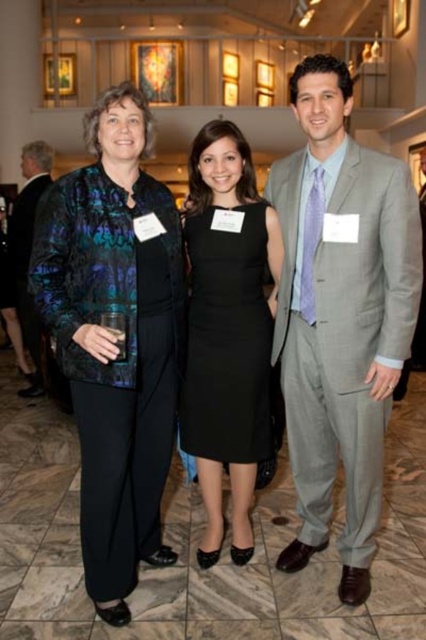
Question: Which point is farther to the camera?

Choices:
 (A) black satin dress at center
 (B) matte black suit at left

Answer: (B)

Question: Is gray suit at center wider than black satin dress at center?

Choices:
 (A) no
 (B) yes

Answer: (B)

Question: Is velvet-like black pantsuit at left below matte black suit at left?

Choices:
 (A) yes
 (B) no

Answer: (A)

Question: Is gray suit at center bigger than velvet-like black pantsuit at left?

Choices:
 (A) no
 (B) yes

Answer: (A)

Question: Estimate the real-world distances between objects in this image. Which object is farther from the black satin dress at center?

Choices:
 (A) gray suit at center
 (B) velvet-like black pantsuit at left
 (C) matte black suit at left

Answer: (C)

Question: Among these objects, which one is farthest from the camera?

Choices:
 (A) black satin dress at center
 (B) velvet-like black pantsuit at left

Answer: (A)